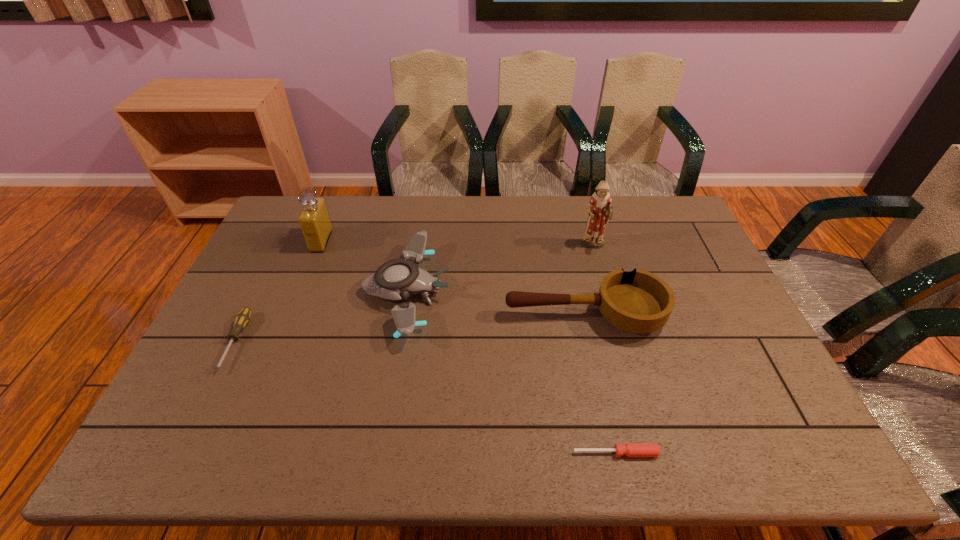
This screenshot has width=960, height=540. In order to click on vacant space in between the drone and the saucepan in this screenshot , I will do `click(495, 303)`.

What are the coordinates of `vacant space in between the second tallest object and the left screwdriver` in the screenshot? It's located at (278, 292).

Locate an element on the screen. This screenshot has height=540, width=960. free space between the farther screwdriver and the perfume is located at coordinates (278, 292).

Identify which object is the third nearest to the saucepan. Please provide its 2D coordinates. Your answer should be formatted as a tuple, i.e. [(x, y)], where the tuple contains the x and y coordinates of a point satisfying the conditions above.

[(629, 449)]

Select which object appears as the closest to the saucepan. Please provide its 2D coordinates. Your answer should be formatted as a tuple, i.e. [(x, y)], where the tuple contains the x and y coordinates of a point satisfying the conditions above.

[(397, 279)]

Where is `free space that satisfies the following two spatial constraints: 1. on the front-facing side of the drone; 2. at the tip of the taller screwdriver`? free space that satisfies the following two spatial constraints: 1. on the front-facing side of the drone; 2. at the tip of the taller screwdriver is located at coordinates (398, 342).

Where is `free spot that satisfies the following two spatial constraints: 1. on the front-facing side of the second object from left to right; 2. at the tip of the farther screwdriver`? free spot that satisfies the following two spatial constraints: 1. on the front-facing side of the second object from left to right; 2. at the tip of the farther screwdriver is located at coordinates (280, 342).

Identify the location of vacant region that satisfies the following two spatial constraints: 1. on the front-facing side of the second tallest object; 2. with the handle on the side of the saucepan. Image resolution: width=960 pixels, height=540 pixels. (292, 315).

Where is `free location that satisfies the following two spatial constraints: 1. at the tip of the leftmost object; 2. on the left side of the shorter screwdriver`? free location that satisfies the following two spatial constraints: 1. at the tip of the leftmost object; 2. on the left side of the shorter screwdriver is located at coordinates (180, 453).

Identify the location of free space that satisfies the following two spatial constraints: 1. on the front-facing side of the drone; 2. with the handle on the side of the saucepan. (403, 315).